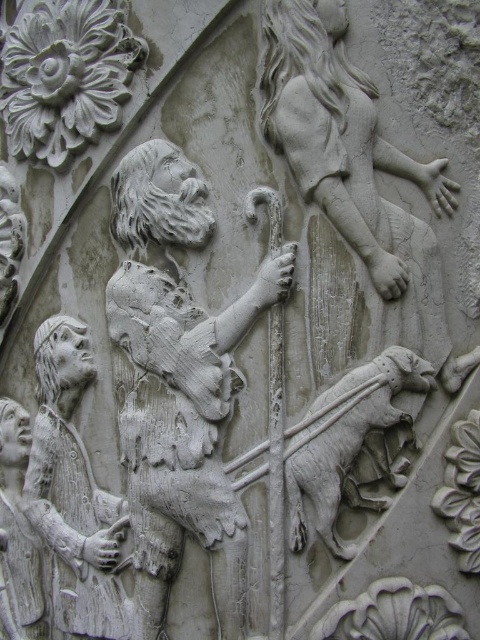
Is white stone shepherd at center further to the viewer compared to white stone shepherd at lower left?

No, it is not.

Find the location of a particular element. This screenshot has width=480, height=640. white stone shepherd at center is located at coordinates (177, 385).

Locate an element on the screen. The width and height of the screenshot is (480, 640). white stone shepherd at center is located at coordinates (177, 385).

Does point (66, 403) lie behind point (361, 365)?

Yes, it is behind point (361, 365).

Is white stone shepherd at lower left taller than white stone lion at center?

Correct, white stone shepherd at lower left is much taller as white stone lion at center.

The height and width of the screenshot is (640, 480). In order to click on white stone shepherd at lower left in this screenshot , I will do `click(72, 492)`.

You are a GUI agent. You are given a task and a screenshot of the screen. Output one action in this format:
    pyautogui.click(x=<x>, y=<y>)
    Task: Click on the white stone shepherd at lower left
    Image resolution: width=480 pixels, height=640 pixels.
    Given the screenshot: What is the action you would take?
    pyautogui.click(x=72, y=492)

Can you confirm if white stone shepherd at center is thinner than white stone lion at center?

No, white stone shepherd at center is not thinner than white stone lion at center.

Is white stone shepherd at center closer to camera compared to white stone lion at center?

No, white stone shepherd at center is behind white stone lion at center.

Does point (182, 387) come behind point (316, 513)?

Yes, it is.

Identify the location of white stone shepherd at center. This screenshot has height=640, width=480. (177, 385).